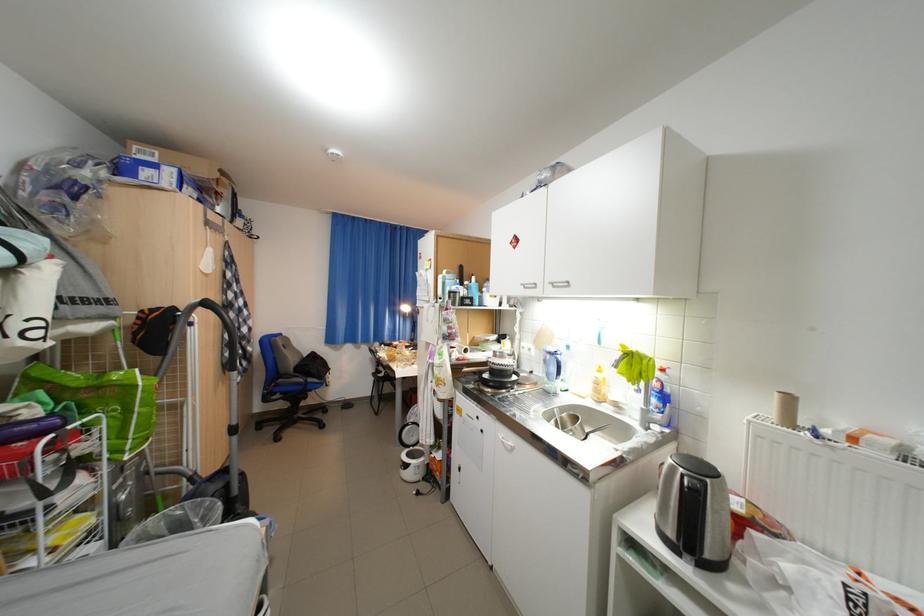
The width and height of the screenshot is (924, 616). I want to click on faucet handle, so click(637, 375).